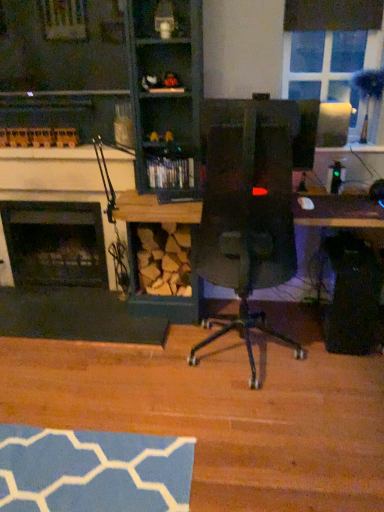
Find the location of a particular element. free point above black glass fireplace at left, which appears as the first fireplace when viewed from the front (from a real-world perspective) is located at coordinates (49, 159).